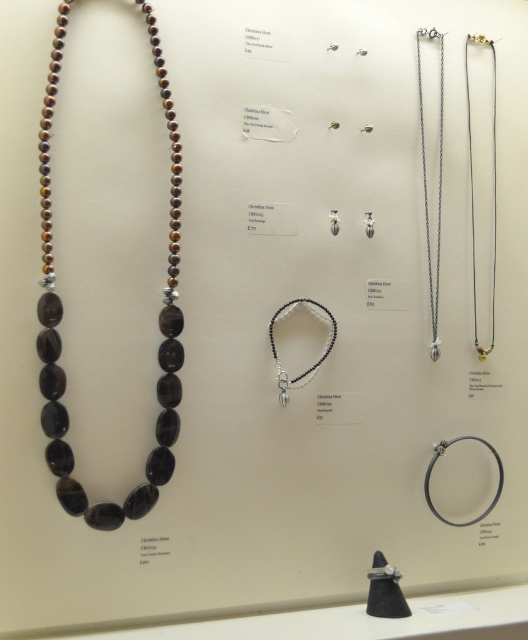
You are a customer at a jewelry store and want to choose between the silver metallic chain at upper right and the black beaded bracelet at center. Which one has a thinner design?

The silver metallic chain at upper right is thinner than the black beaded bracelet at center.

You are a customer in a jewelry store and want to know if the brown polished stone necklace at left is within reach of the silver clasp on the bracelet in the center. The store has a rule that items must be at least 1 meter apart for safety. Can you confirm if this requirement is met?

The brown polished stone necklace at left and the bracelet in the center are 1.28 meters apart, which exceeds the 1 meter requirement, so the safety rule is satisfied.

Where is the brown polished stone necklace at left located in the image?

The brown polished stone necklace at left is located at point (x=61, y=317).